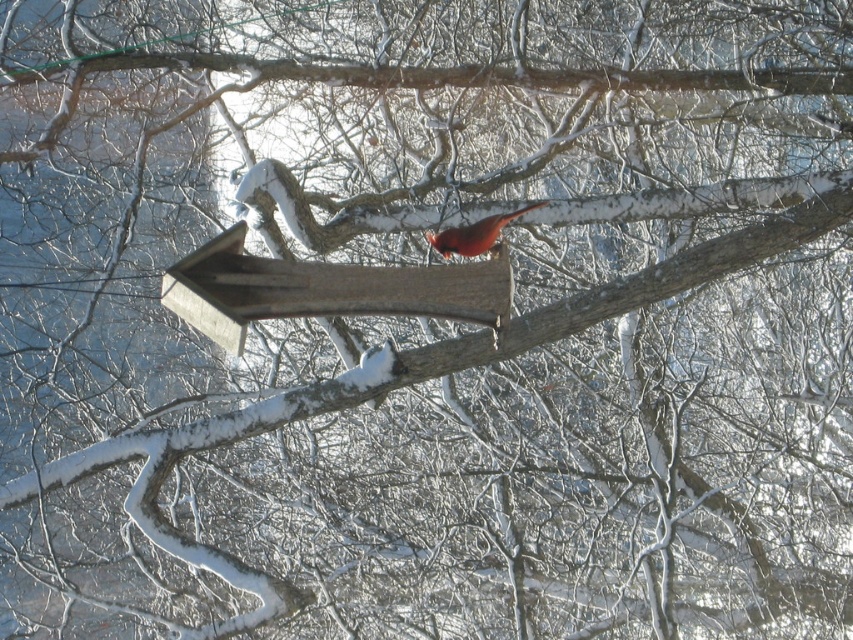
Is point (450, 289) less distant than point (463, 237)?

Yes, point (450, 289) is in front of point (463, 237).

Is wooden bird feeder at center further to camera compared to matte red bird at center?

No.

Who is more distant from viewer, (416, 272) or (543, 202)?

Point (543, 202)

Locate an element on the screen. The height and width of the screenshot is (640, 853). wooden bird feeder at center is located at coordinates (323, 289).